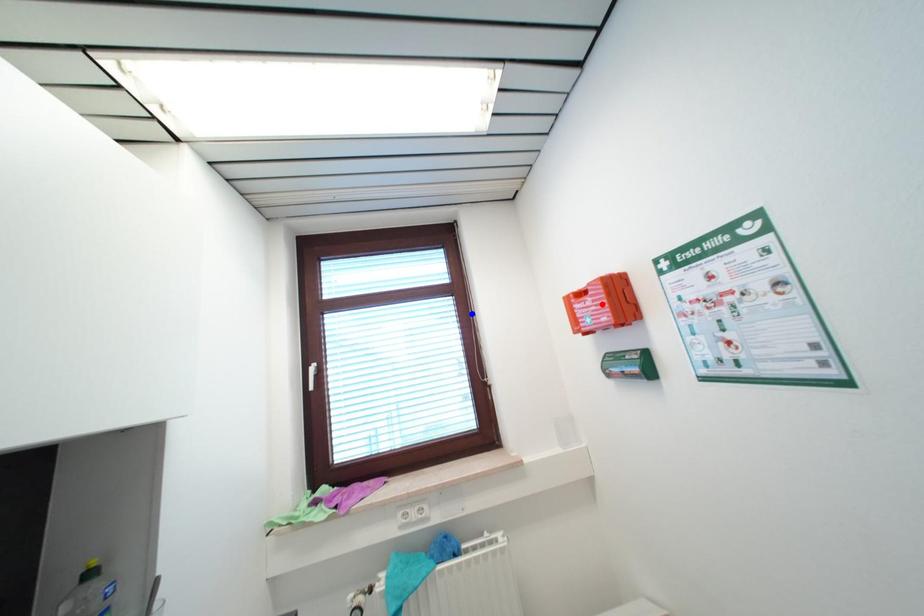
Question: Which of the two points in the image is closer to the camera?

Choices:
 (A) Blue point is closer.
 (B) Red point is closer.

Answer: (B)